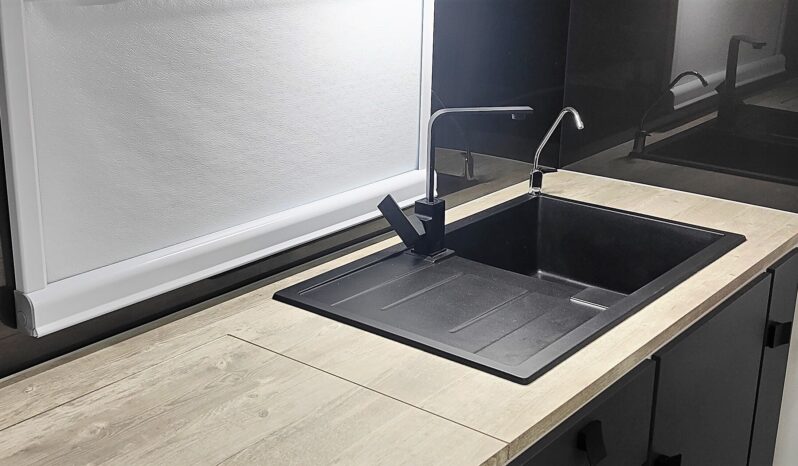
This screenshot has height=466, width=798. I want to click on faucet, so click(x=437, y=214).